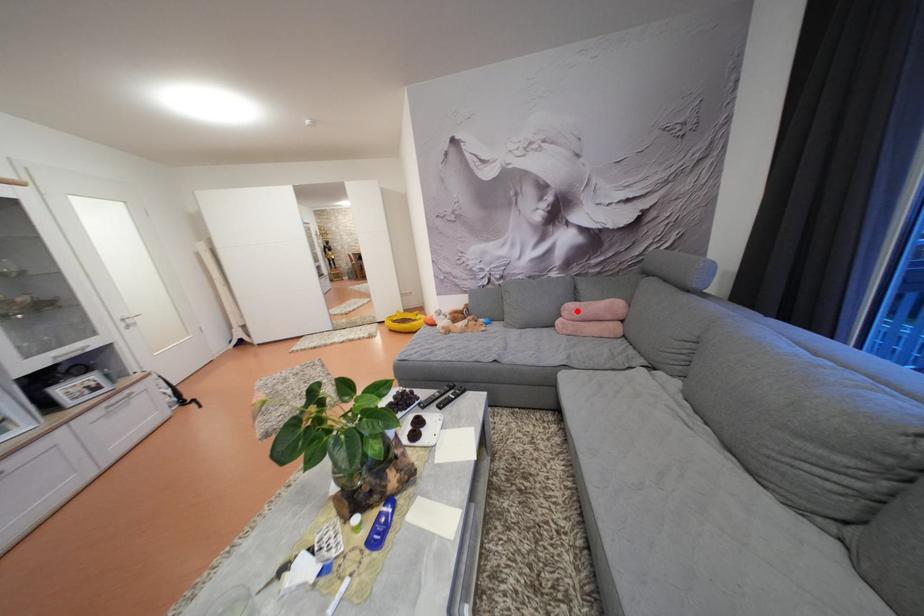
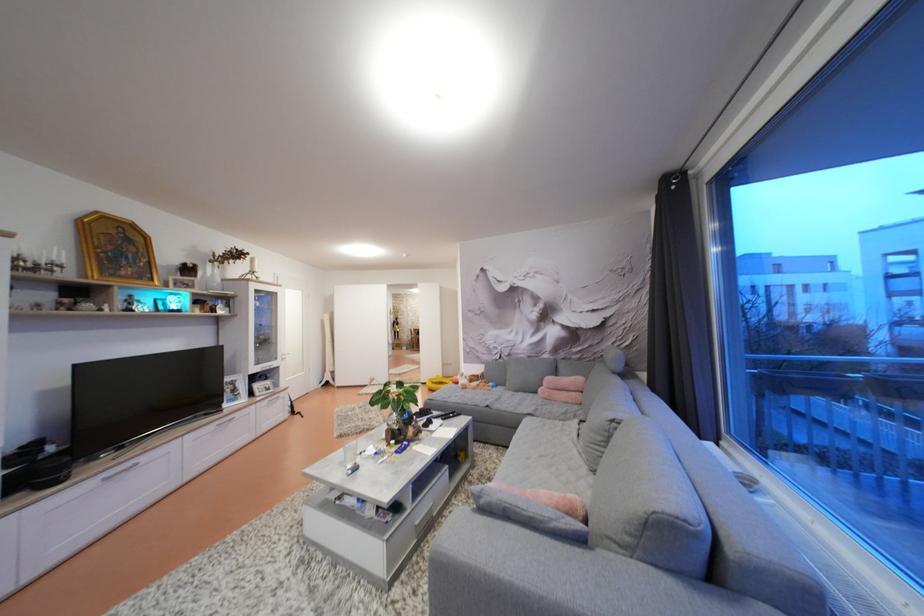
The point at the highlighted location is marked in the first image. Where is the corresponding point in the second image?

(556, 384)